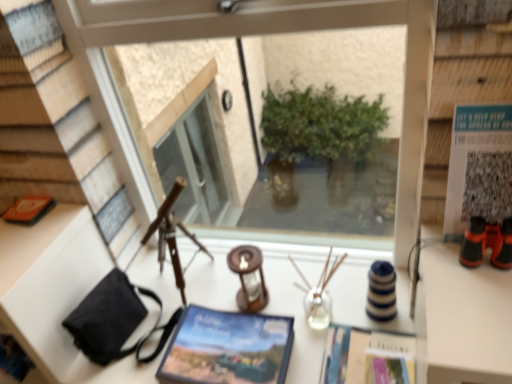
Question: From a real-world perspective, is matte paper magazine at center, the first magazine positioned from the right, physically located above or below orange matte book at left?

Choices:
 (A) above
 (B) below

Answer: (B)

Question: From the image's perspective, is matte paper magazine at center, the first magazine positioned from the right, located above or below orange matte book at left?

Choices:
 (A) above
 (B) below

Answer: (B)

Question: Which is nearer to the white paper at upper right?

Choices:
 (A) wooden candle holder at center, placed as the first candle holder when sorted from left to right
 (B) translucent glass candle holder at center, the second candle holder positioned from the left
 (C) orange matte book at left
 (D) white matte writing desk at center
 (E) transparent glass window at center

Answer: (E)

Question: Which is farther from the orange matte book at left?

Choices:
 (A) transparent glass window at center
 (B) white paper at upper right
 (C) white matte writing desk at center
 (D) translucent glass candle holder at center, the second candle holder positioned from the left
 (E) matte blue book at center, which appears as the first magazine when viewed from the left

Answer: (B)